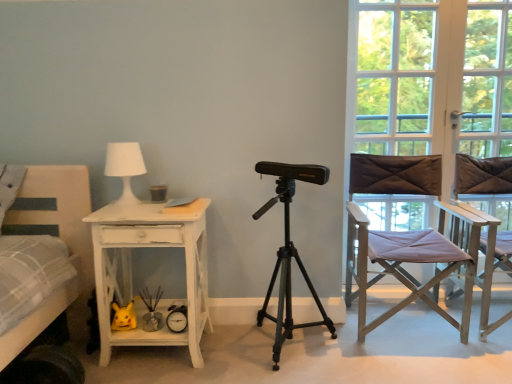
Question: Considering the relative sizes of white matte table lamp at upper left and light brown fabric director's chair at right, the first chair from the left, in the image provided, is white matte table lamp at upper left bigger than light brown fabric director's chair at right, the first chair from the left,?

Choices:
 (A) yes
 (B) no

Answer: (B)

Question: From the image's perspective, is white matte table lamp at upper left on top of light brown fabric director's chair at right, which is the second chair in right-to-left order?

Choices:
 (A) yes
 (B) no

Answer: (A)

Question: From a real-world perspective, is white matte table lamp at upper left positioned under light brown fabric director's chair at right, the first chair from the left, based on gravity?

Choices:
 (A) no
 (B) yes

Answer: (A)

Question: From a real-world perspective, is white matte table lamp at upper left positioned over light brown fabric director's chair at right, which is the second chair in right-to-left order, based on gravity?

Choices:
 (A) no
 (B) yes

Answer: (B)

Question: Does white matte table lamp at upper left appear on the right side of light brown fabric director's chair at right, the first chair from the left?

Choices:
 (A) no
 (B) yes

Answer: (A)

Question: Visually, is light brown wooden chair at right, which ranks as the 1th chair in right-to-left order, positioned to the left or to the right of white glass window frame at right?

Choices:
 (A) left
 (B) right

Answer: (B)

Question: Is point (500, 261) closer or farther from the camera than point (395, 6)?

Choices:
 (A) farther
 (B) closer

Answer: (B)

Question: Considering the positions of light brown wooden chair at right, which ranks as the 1th chair in right-to-left order, and white glass window frame at right in the image, is light brown wooden chair at right, which ranks as the 1th chair in right-to-left order, bigger or smaller than white glass window frame at right?

Choices:
 (A) big
 (B) small

Answer: (A)

Question: Is light brown wooden chair at right, the second chair viewed from the left, situated inside white glass window frame at right or outside?

Choices:
 (A) outside
 (B) inside

Answer: (A)

Question: Is light brown wooden chair at right, which ranks as the 1th chair in right-to-left order, bigger or smaller than clear glass window at right?

Choices:
 (A) big
 (B) small

Answer: (A)

Question: Does point (485, 241) appear closer or farther from the camera than point (355, 84)?

Choices:
 (A) farther
 (B) closer

Answer: (B)

Question: Relative to clear glass window at right, is light brown wooden chair at right, which ranks as the 1th chair in right-to-left order, in front or behind?

Choices:
 (A) behind
 (B) front

Answer: (B)

Question: From a real-world perspective, is light brown wooden chair at right, which ranks as the 1th chair in right-to-left order, physically located above or below clear glass window at right?

Choices:
 (A) above
 (B) below

Answer: (B)

Question: From the image's perspective, is light brown wooden chair at right, which ranks as the 1th chair in right-to-left order, located above or below metallic tripod at center?

Choices:
 (A) below
 (B) above

Answer: (B)

Question: Looking at the image, does light brown wooden chair at right, which ranks as the 1th chair in right-to-left order, seem bigger or smaller compared to metallic tripod at center?

Choices:
 (A) big
 (B) small

Answer: (A)